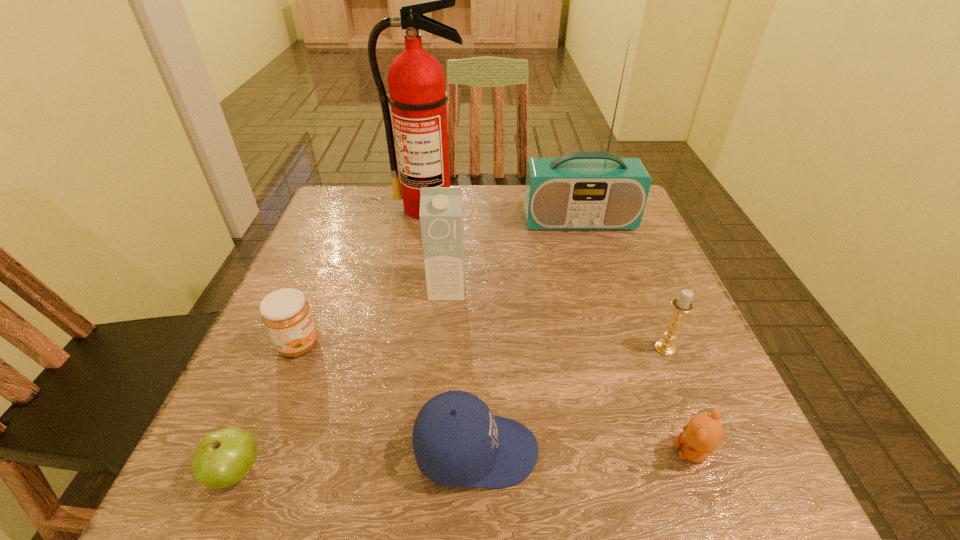
In order to click on vacant space located 0.360m on the front panel of the second tallest object in this screenshot , I will do `click(617, 348)`.

This screenshot has width=960, height=540. What are the coordinates of `vacant space located on the front label of the carton` in the screenshot? It's located at (444, 326).

At what (x,y) coordinates should I click in order to perform the action: click on free location located on the back of the fifth shortest object. Please return your answer as a coordinate pair (x, y). This screenshot has width=960, height=540. Looking at the image, I should click on (619, 234).

The image size is (960, 540). I want to click on vacant region located on the front label of the jam, so click(x=449, y=345).

Identify the location of free space located 0.210m on the front-facing side of the cap. (678, 451).

I want to click on free space located on the face of the teddy bear, so click(x=441, y=452).

The height and width of the screenshot is (540, 960). What are the coordinates of `vacant area located 0.090m on the face of the teddy bear` in the screenshot? It's located at (614, 452).

The height and width of the screenshot is (540, 960). Identify the location of free space located 0.300m on the face of the teddy bear. (474, 452).

What are the coordinates of `free space located on the right of the apple` in the screenshot? It's located at (485, 471).

Locate an element on the screen. This screenshot has width=960, height=540. fire extinguisher that is at the far edge is located at coordinates (417, 94).